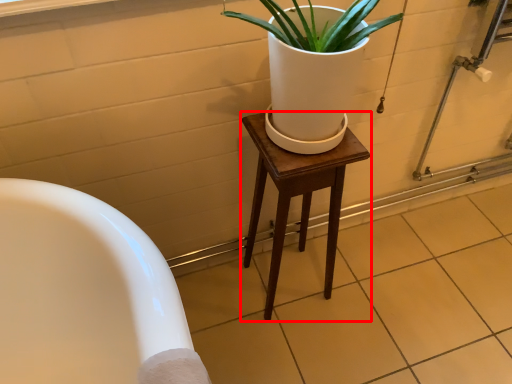
Question: Observing the image, what is the correct spatial positioning of stool (annotated by the red box) in reference to tile?

Choices:
 (A) left
 (B) right

Answer: (A)